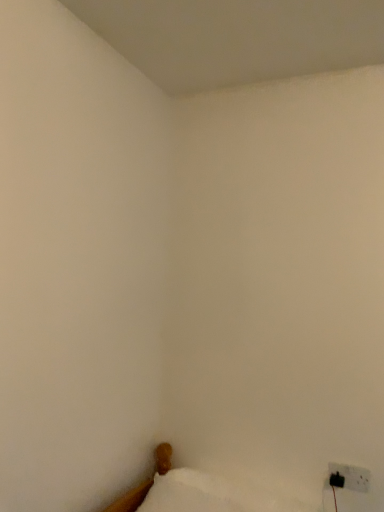
Question: Is white soft pillow at lower left to the right of black plastic electric outlet at lower right from the viewer's perspective?

Choices:
 (A) no
 (B) yes

Answer: (A)

Question: Is the surface of white soft pillow at lower left in direct contact with black plastic electric outlet at lower right?

Choices:
 (A) no
 (B) yes

Answer: (A)

Question: Can black plastic electric outlet at lower right be found inside white soft pillow at lower left?

Choices:
 (A) no
 (B) yes

Answer: (A)

Question: Does white soft pillow at lower left come in front of black plastic electric outlet at lower right?

Choices:
 (A) yes
 (B) no

Answer: (A)

Question: Could you tell me if white soft pillow at lower left is turned towards black plastic electric outlet at lower right?

Choices:
 (A) yes
 (B) no

Answer: (B)

Question: Do you think white soft pillow at lower left is within white fabric bed at lower right, or outside of it?

Choices:
 (A) outside
 (B) inside

Answer: (A)

Question: Is white soft pillow at lower left wider or thinner than white fabric bed at lower right?

Choices:
 (A) thin
 (B) wide

Answer: (B)

Question: Is point (162, 502) positioned closer to the camera than point (147, 508)?

Choices:
 (A) closer
 (B) farther

Answer: (A)

Question: Visually, is white soft pillow at lower left positioned to the left or to the right of white fabric bed at lower right?

Choices:
 (A) left
 (B) right

Answer: (A)

Question: Looking at their shapes, would you say white fabric bed at lower right is wider or thinner than black plastic electric outlet at lower right?

Choices:
 (A) wide
 (B) thin

Answer: (A)

Question: From a real-world perspective, is white fabric bed at lower right positioned above or below black plastic electric outlet at lower right?

Choices:
 (A) above
 (B) below

Answer: (B)

Question: Considering their positions, is white fabric bed at lower right located in front of or behind black plastic electric outlet at lower right?

Choices:
 (A) behind
 (B) front

Answer: (B)

Question: Is point (157, 468) positioned closer to the camera than point (327, 464)?

Choices:
 (A) farther
 (B) closer

Answer: (A)

Question: Is point (355, 488) closer or farther from the camera than point (294, 508)?

Choices:
 (A) farther
 (B) closer

Answer: (B)

Question: Looking at the image, does black plastic electric outlet at lower right seem bigger or smaller compared to white fabric bed at lower right?

Choices:
 (A) small
 (B) big

Answer: (A)